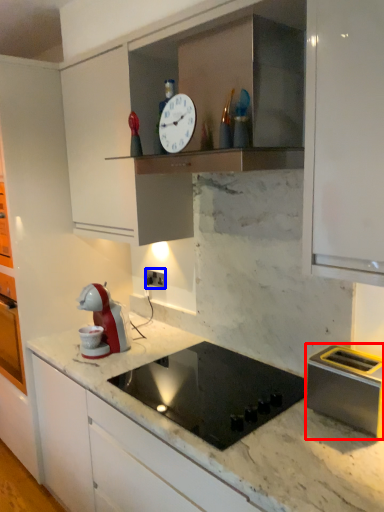
Question: Among these objects, which one is farthest to the camera, kitchen appliance (highlighted by a red box) or electric outlet (highlighted by a blue box)?

Choices:
 (A) kitchen appliance
 (B) electric outlet

Answer: (B)